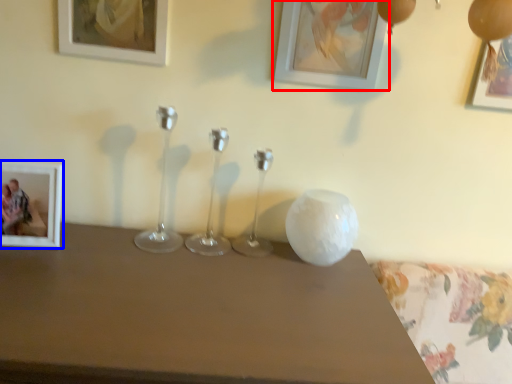
Question: Among these objects, which one is nearest to the camera, picture frame (highlighted by a red box) or picture frame (highlighted by a blue box)?

Choices:
 (A) picture frame
 (B) picture frame

Answer: (B)